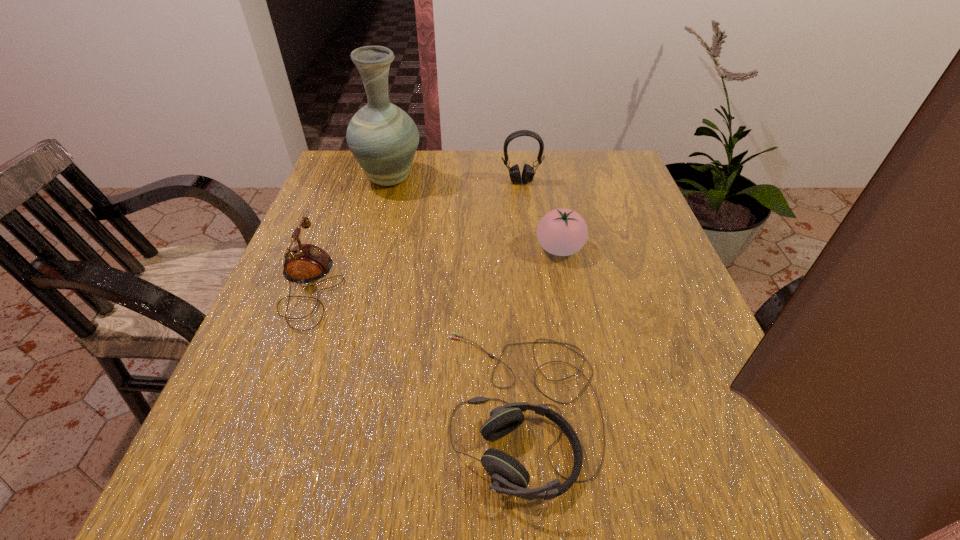
Image resolution: width=960 pixels, height=540 pixels. In order to click on the tallest object in this screenshot , I will do `click(383, 138)`.

Locate an element on the screen. Image resolution: width=960 pixels, height=540 pixels. the taller headset is located at coordinates (528, 172).

Locate an element on the screen. The height and width of the screenshot is (540, 960). the farther headset is located at coordinates (528, 172).

Where is `tomato`? This screenshot has height=540, width=960. tomato is located at coordinates pyautogui.click(x=562, y=232).

What are the coordinates of `telephone` in the screenshot? It's located at (304, 263).

Locate an element on the screen. This screenshot has height=540, width=960. the shortest object is located at coordinates (508, 476).

Locate an element on the screen. the shorter headset is located at coordinates (508, 476).

Locate an element on the screen. vacant space located on the handle side of the tallest object is located at coordinates [x=396, y=153].

At what (x,y) coordinates should I click in order to perform the action: click on vacant position located 0.360m on the front-facing side of the farther headset. Please return your answer as a coordinate pair (x, y). The image size is (960, 540). Looking at the image, I should click on (534, 283).

At what (x,y) coordinates should I click in order to perform the action: click on free point located 0.070m on the front of the tomato. Please return your answer as a coordinate pair (x, y). The width and height of the screenshot is (960, 540). Looking at the image, I should click on (567, 289).